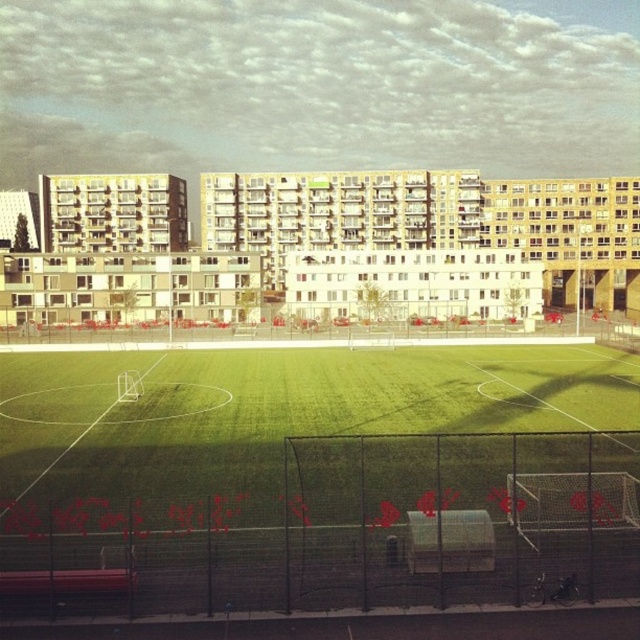
From the picture: Can you confirm if green artificial turf at center is shorter than green grass field at center?

Yes, green artificial turf at center is shorter than green grass field at center.

Does green artificial turf at center have a greater height compared to green grass field at center?

No, green artificial turf at center is not taller than green grass field at center.

Is point (3, 580) closer to viewer compared to point (100, 184)?

Yes.

The image size is (640, 640). I want to click on green artificial turf at center, so click(317, 480).